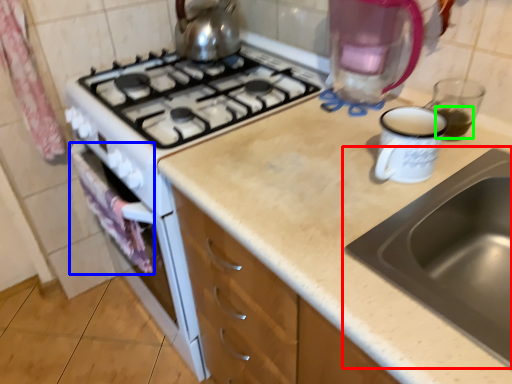
Question: Which is nearer to the sink (highlighted by a red box)? cloth (highlighted by a blue box) or beverage (highlighted by a green box).

Choices:
 (A) cloth
 (B) beverage

Answer: (B)